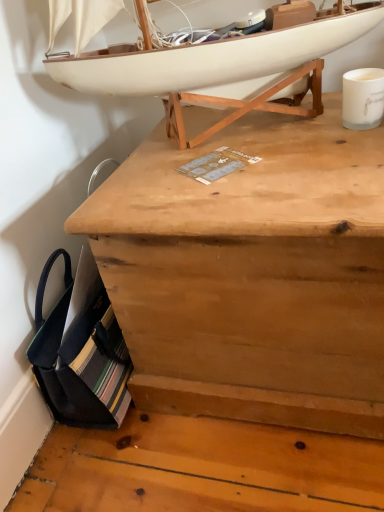
Where is `natural wood chest at center`? The height and width of the screenshot is (512, 384). natural wood chest at center is located at coordinates (251, 274).

What do you see at coordinates (210, 60) in the screenshot?
I see `white matte boat at upper center` at bounding box center [210, 60].

This screenshot has height=512, width=384. I want to click on white matte coffee cup at upper right, so click(x=363, y=98).

Looking at this image, is white matte boat at upper center looking in the opposite direction of natural wood chest at center?

No, white matte boat at upper center is not facing away from natural wood chest at center.

From the picture: Is white matte boat at upper center far away from natural wood chest at center?

white matte boat at upper center is actually quite close to natural wood chest at center.

From the picture: Considering the relative positions of white matte boat at upper center and natural wood chest at center in the image provided, is white matte boat at upper center to the right of natural wood chest at center from the viewer's perspective?

Incorrect, white matte boat at upper center is not on the right side of natural wood chest at center.

The width and height of the screenshot is (384, 512). I want to click on boat that is behind the natural wood chest at center, so click(x=210, y=60).

Considering the points (355, 82) and (152, 178), which point is behind, point (355, 82) or point (152, 178)?

The point (355, 82) is more distant.

How different are the orientations of white matte coffee cup at upper right and natural wood chest at center in degrees?

There is a 8.4-degree angle between the facing directions of white matte coffee cup at upper right and natural wood chest at center.

Considering the sizes of objects white matte coffee cup at upper right and natural wood chest at center in the image provided, who is taller, white matte coffee cup at upper right or natural wood chest at center?

Standing taller between the two is natural wood chest at center.

Which object is further away from the camera taking this photo, white matte coffee cup at upper right or natural wood chest at center?

Positioned behind is white matte coffee cup at upper right.

Does point (349, 113) come farther from viewer compared to point (346, 29)?

No, it is not.

Which of these two, white matte coffee cup at upper right or white matte boat at upper center, is bigger?

With larger size is white matte boat at upper center.

Considering the positions of objects white matte coffee cup at upper right and white matte boat at upper center in the image provided, who is more to the left, white matte coffee cup at upper right or white matte boat at upper center?

white matte boat at upper center is more to the left.

Considering the sizes of objects white matte coffee cup at upper right and white matte boat at upper center in the image provided, who is taller, white matte coffee cup at upper right or white matte boat at upper center?

white matte boat at upper center is taller.

What's the angular difference between natural wood chest at center and white matte coffee cup at upper right's facing directions?

8.4 degrees.

Looking at this image, considering the relative positions of natural wood chest at center and white matte coffee cup at upper right in the image provided, is natural wood chest at center to the right of white matte coffee cup at upper right from the viewer's perspective?

No, natural wood chest at center is not to the right of white matte coffee cup at upper right.

From a real-world perspective, does natural wood chest at center sit lower than white matte coffee cup at upper right?

Correct, in the physical world, natural wood chest at center is lower than white matte coffee cup at upper right.

Is natural wood chest at center surrounding white matte coffee cup at upper right?

No.

Choose the correct answer: Is white matte boat at upper center inside white matte coffee cup at upper right or outside it?

white matte boat at upper center is outside white matte coffee cup at upper right.

Is white matte boat at upper center taller than white matte coffee cup at upper right?

Yes, white matte boat at upper center is taller than white matte coffee cup at upper right.

Considering the relative sizes of white matte boat at upper center and white matte coffee cup at upper right in the image provided, is white matte boat at upper center bigger than white matte coffee cup at upper right?

Indeed, white matte boat at upper center has a larger size compared to white matte coffee cup at upper right.

Is natural wood chest at center facing away from white matte boat at upper center?

No, natural wood chest at center is not facing the opposite direction of white matte boat at upper center.

From a real-world perspective, does natural wood chest at center stand above white matte boat at upper center?

No.

Is natural wood chest at center bigger than white matte boat at upper center?

Correct, natural wood chest at center is larger in size than white matte boat at upper center.

This screenshot has width=384, height=512. I want to click on desk in front of the white matte boat at upper center, so click(251, 274).

Find the location of a particular element. This screenshot has height=512, width=384. desk on the left of the white matte coffee cup at upper right is located at coordinates (251, 274).

When comparing their distances from natural wood chest at center, does white matte coffee cup at upper right or white matte boat at upper center seem further?

Among the two, white matte coffee cup at upper right is located further to natural wood chest at center.

Based on their spatial positions, is natural wood chest at center or white matte coffee cup at upper right further from white matte boat at upper center?

Based on the image, natural wood chest at center appears to be further to white matte boat at upper center.

Based on the photo, estimate the real-world distances between objects in this image. Which object is closer to white matte coffee cup at upper right, white matte boat at upper center or natural wood chest at center?

Based on the image, white matte boat at upper center appears to be nearer to white matte coffee cup at upper right.

When comparing their distances from natural wood chest at center, does white matte boat at upper center or white matte coffee cup at upper right seem closer?

The object closer to natural wood chest at center is white matte boat at upper center.

When comparing their distances from white matte coffee cup at upper right, does natural wood chest at center or white matte boat at upper center seem further?

natural wood chest at center lies further to white matte coffee cup at upper right than the other object.

When comparing their distances from white matte boat at upper center, does white matte coffee cup at upper right or natural wood chest at center seem closer?

white matte coffee cup at upper right.

Locate an element on the screen. This screenshot has height=512, width=384. coffee cup between white matte boat at upper center and natural wood chest at center from top to bottom is located at coordinates (363, 98).